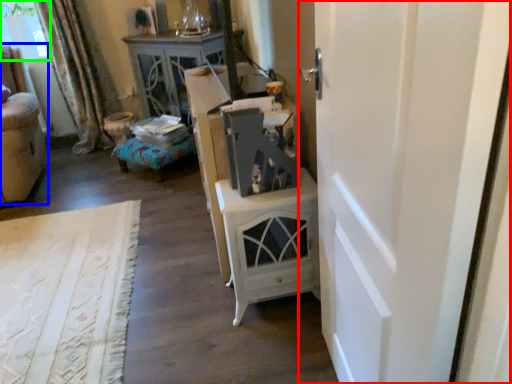
Question: Based on their relative distances, which object is farther from door (highlighted by a red box)? Choose from furniture (highlighted by a blue box) and window screen (highlighted by a green box).

Choices:
 (A) furniture
 (B) window screen

Answer: (B)